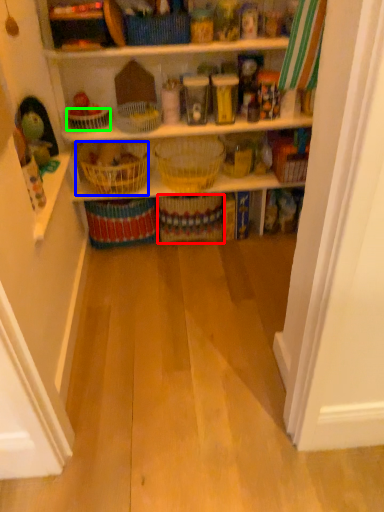
Question: Estimate the real-world distances between objects in this image. Which object is farther from basket (highlighted by a red box), basket (highlighted by a blue box) or basket (highlighted by a green box)?

Choices:
 (A) basket
 (B) basket

Answer: (B)